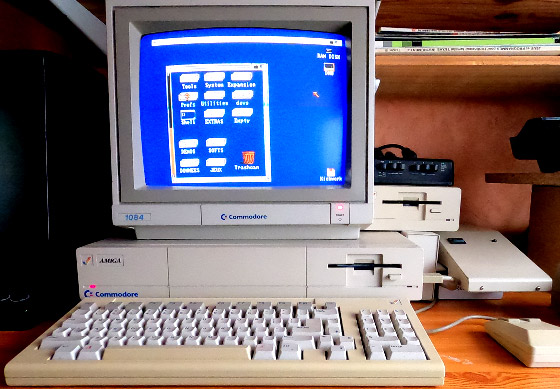
You are a GUI agent. You are given a task and a screenshot of the screen. Output one action in this format:
    pyautogui.click(x=<x>, y=<y>)
    Task: Click on the keyboard
    Image resolution: width=560 pixels, height=389 pixels.
    Given the screenshot: What is the action you would take?
    pyautogui.click(x=300, y=335)